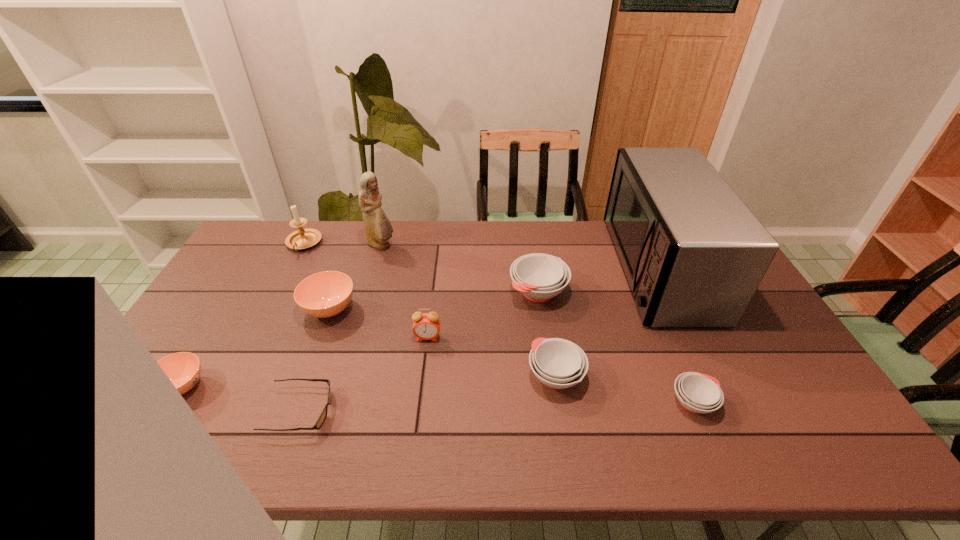
In order to click on object that ranks as the second closest to the shortest object in this screenshot , I will do `click(325, 294)`.

Identify which object is the third nearest to the sixth object from left to right. Please provide its 2D coordinates. Your answer should be formatted as a tuple, i.e. [(x, y)], where the tuple contains the x and y coordinates of a point satisfying the conditions above.

[(322, 417)]

Identify the location of soup bowl that is the closest to the rightmost white soup bowl. (558, 363).

Where is `soup bowl that is the fifth closest to the third tallest object`? soup bowl that is the fifth closest to the third tallest object is located at coordinates click(x=698, y=393).

The image size is (960, 540). Find the location of `white soup bowl that is the second closest to the pink alarm clock`. white soup bowl that is the second closest to the pink alarm clock is located at coordinates (558, 363).

Identify which white soup bowl is the third closest to the figurine. Please provide its 2D coordinates. Your answer should be formatted as a tuple, i.e. [(x, y)], where the tuple contains the x and y coordinates of a point satisfying the conditions above.

[(698, 393)]

Locate an element on the screen. free space that satisfies the following two spatial constraints: 1. on the front-facing side of the grey microwave_oven; 2. on the front side of the second smallest white soup bowl is located at coordinates (709, 376).

The width and height of the screenshot is (960, 540). Identify the location of vacant region that satisfies the following two spatial constraints: 1. on the back side of the left peach soup bowl; 2. on the left side of the farthest white soup bowl. (239, 292).

Where is `blank space that satisfies the following two spatial constraints: 1. with a handle on the side of the third tallest object; 2. on the left side of the second smallest white soup bowl`? The height and width of the screenshot is (540, 960). blank space that satisfies the following two spatial constraints: 1. with a handle on the side of the third tallest object; 2. on the left side of the second smallest white soup bowl is located at coordinates (237, 376).